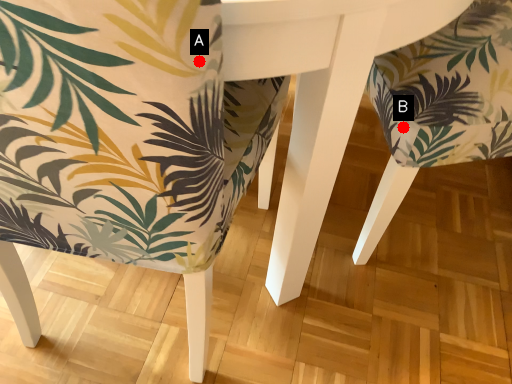
Question: Two points are circled on the image, labeled by A and B beside each circle. Which point is closer to the camera?

Choices:
 (A) A is closer
 (B) B is closer

Answer: (A)